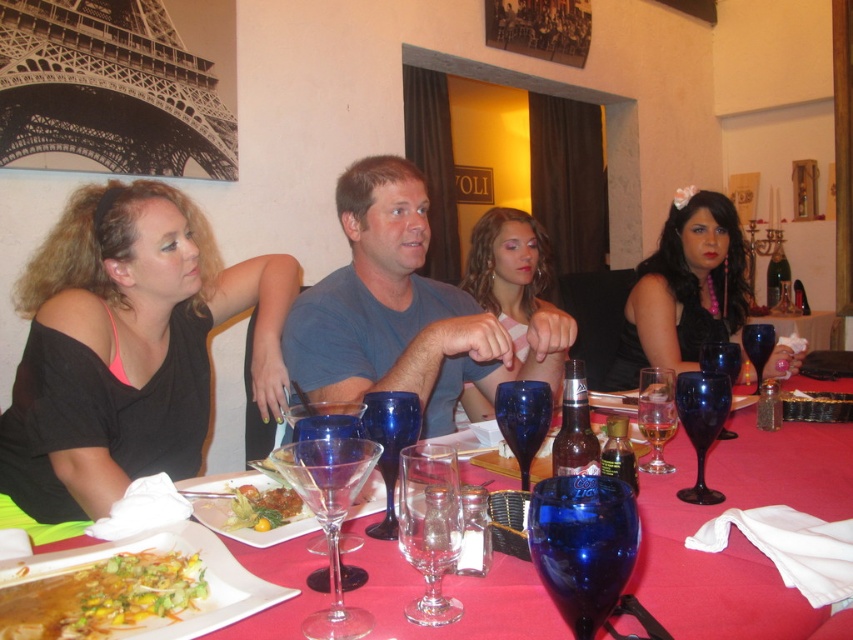
Between blue glass at center and clear glass wine glass at center, which one appears on the right side from the viewer's perspective?

clear glass wine glass at center is more to the right.

Between point (616, 593) and point (656, 426), which one is positioned behind?

Positioned behind is point (656, 426).

Find the location of a particular element. This screenshot has height=640, width=853. blue glass at center is located at coordinates (583, 545).

Who is positioned more to the left, transparent blue martini glass at center or shiny green salad at center?

shiny green salad at center is more to the left.

Which is behind, point (328, 408) or point (263, 499)?

Point (263, 499)

Where is `transparent blue martini glass at center`? transparent blue martini glass at center is located at coordinates (323, 419).

Is translucent blue glass at center smaller than clear glass wine glass at center?

Actually, translucent blue glass at center might be larger than clear glass wine glass at center.

Is translucent blue glass at center wider than clear glass wine glass at center?

Indeed, translucent blue glass at center has a greater width compared to clear glass wine glass at center.

What do you see at coordinates (740, 532) in the screenshot?
I see `translucent blue glass at center` at bounding box center [740, 532].

Locate an element on the screen. The width and height of the screenshot is (853, 640). translucent blue glass at center is located at coordinates (740, 532).